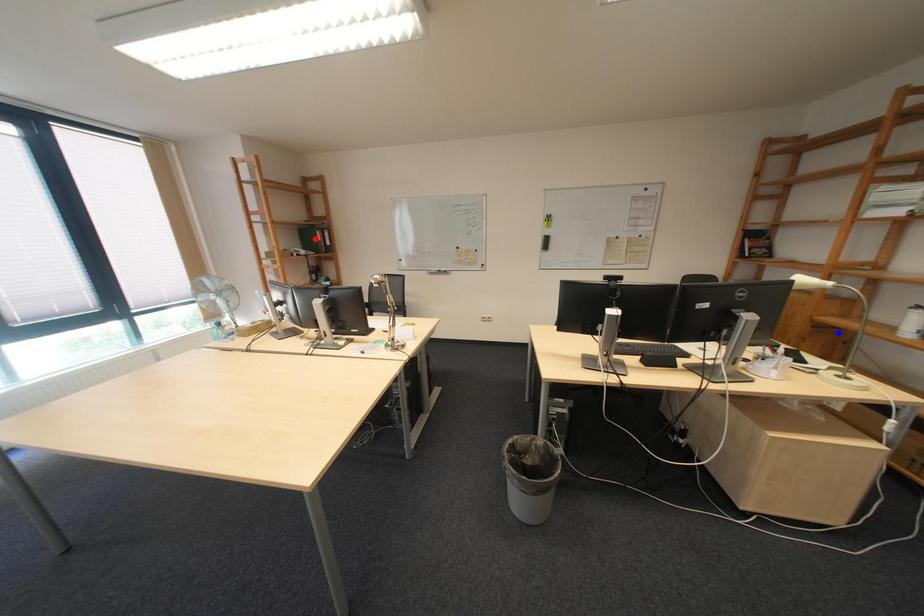
Question: In the image, two points are highlighted. Which point is nearer to the camera? Reply with the corresponding letter.

Choices:
 (A) blue point
 (B) red point

Answer: (A)